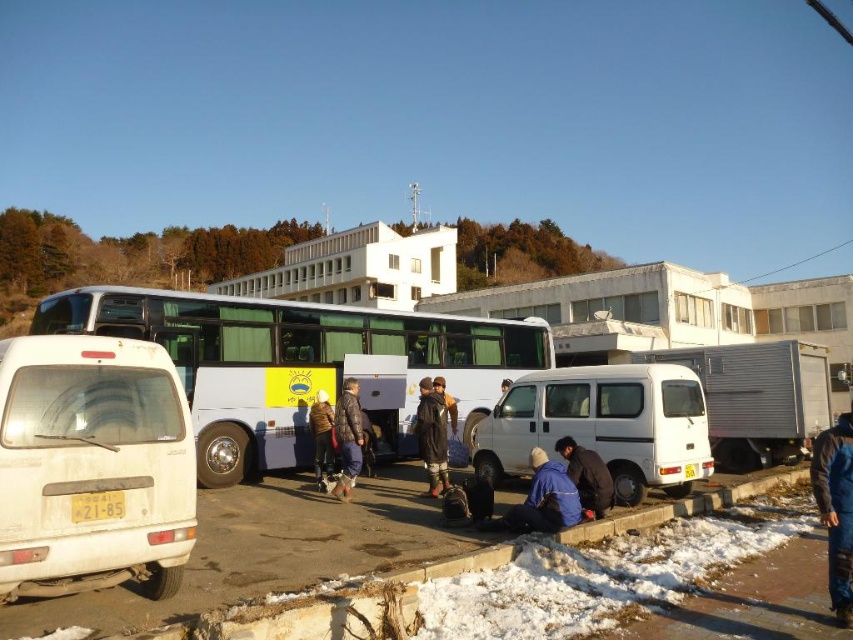
You are a passenger waiting at the bus station. You see the white matte bus at center and the white matte van at center. Which vehicle is closer to you?

The white matte van at center is behind the white matte bus at center, so the white matte bus at center is closer to you.

What is located at the coordinates point (432, 435)?

The dark brown leather jacket at center is located at point (432, 435).

You are standing at the bus station and want to take a photo of both the point at coordinates [426,401] and the point at coordinates [595,477]. Which point should you focus on first to ensure both are in focus?

You should focus on the point at coordinates [426,401] first because it is closer to the camera than the point at coordinates [595,477]. This ensures both points will be in focus when using depth of field.